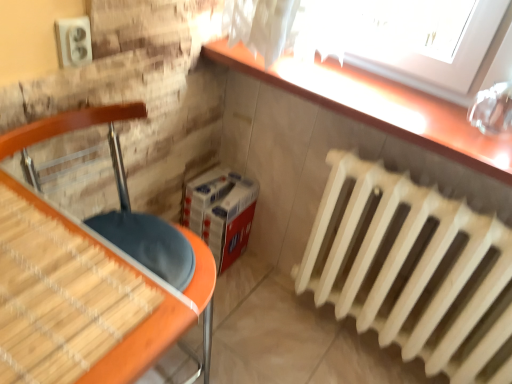
Question: Considering the positions of point (13, 226) and point (485, 137), is point (13, 226) closer or farther from the camera than point (485, 137)?

Choices:
 (A) closer
 (B) farther

Answer: (A)

Question: Considering the positions of matte orange table at lower left and smooth wooden counter at upper right in the image, is matte orange table at lower left taller or shorter than smooth wooden counter at upper right?

Choices:
 (A) short
 (B) tall

Answer: (B)

Question: Considering the real-world distances, which object is farthest from the smooth wooden counter at upper right?

Choices:
 (A) white wooden radiator at lower right
 (B) matte orange table at lower left

Answer: (B)

Question: Which object is positioned closest to the smooth wooden counter at upper right?

Choices:
 (A) matte orange table at lower left
 (B) white wooden radiator at lower right

Answer: (B)